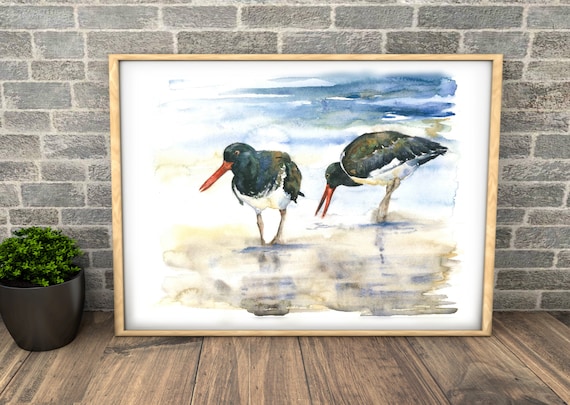
Image resolution: width=570 pixels, height=405 pixels. Identify the location of painting. (x=311, y=130).